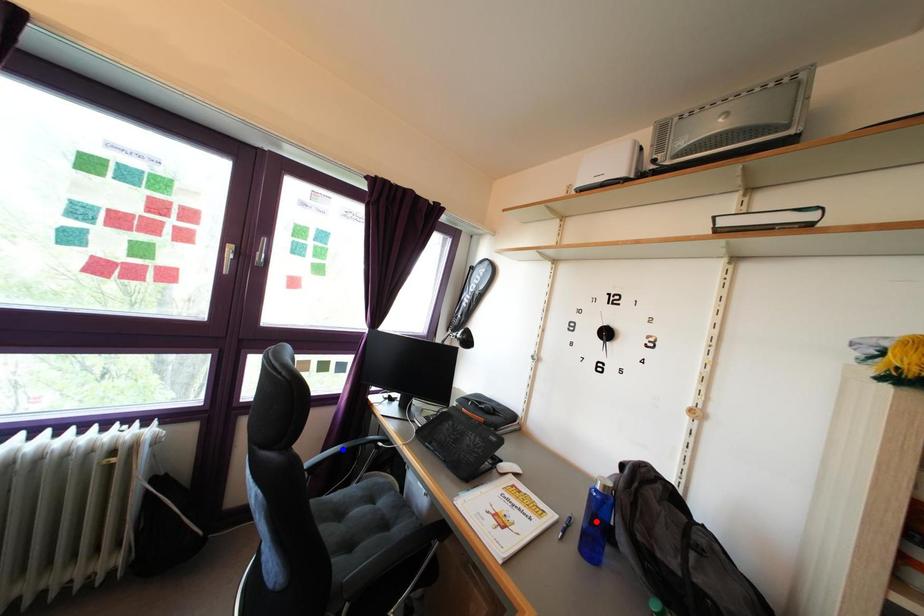
Question: Two points are marked on the image. Which point is closer to the camera?

Choices:
 (A) Blue point is closer.
 (B) Red point is closer.

Answer: (B)